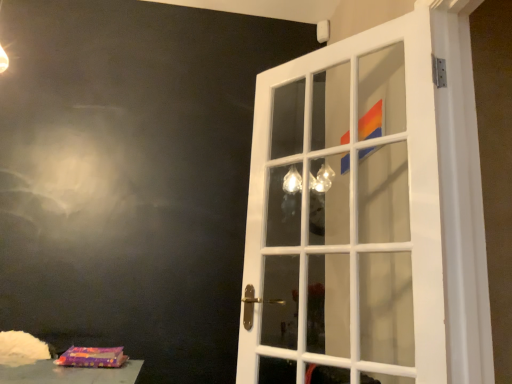
Question: Considering the relative sizes of white glass door at center and purple fabric bag at lower left in the image provided, is white glass door at center shorter than purple fabric bag at lower left?

Choices:
 (A) yes
 (B) no

Answer: (B)

Question: Can you confirm if white glass door at center is taller than purple fabric bag at lower left?

Choices:
 (A) yes
 (B) no

Answer: (A)

Question: Would you say white glass door at center is a long distance from purple fabric bag at lower left?

Choices:
 (A) no
 (B) yes

Answer: (B)

Question: Is white glass door at center located outside purple fabric bag at lower left?

Choices:
 (A) no
 (B) yes

Answer: (B)

Question: Is white glass door at center smaller than purple fabric bag at lower left?

Choices:
 (A) yes
 (B) no

Answer: (B)

Question: Considering the relative positions of white glass door at center and purple fabric bag at lower left in the image provided, is white glass door at center behind purple fabric bag at lower left?

Choices:
 (A) yes
 (B) no

Answer: (B)

Question: Is purple fabric bag at lower left thinner than white glass door at center?

Choices:
 (A) yes
 (B) no

Answer: (A)

Question: From the image's perspective, does purple fabric bag at lower left appear higher than white glass door at center?

Choices:
 (A) yes
 (B) no

Answer: (B)

Question: Can you confirm if purple fabric bag at lower left is taller than white glass door at center?

Choices:
 (A) no
 (B) yes

Answer: (A)

Question: Is purple fabric bag at lower left oriented towards white glass door at center?

Choices:
 (A) yes
 (B) no

Answer: (B)

Question: From a real-world perspective, is purple fabric bag at lower left physically below white glass door at center?

Choices:
 (A) no
 (B) yes

Answer: (B)

Question: From the image's perspective, does purple fabric bag at lower left appear lower than white glass door at center?

Choices:
 (A) no
 (B) yes

Answer: (B)

Question: Considering the positions of purple fabric bag at lower left and white glass door at center in the image, is purple fabric bag at lower left bigger or smaller than white glass door at center?

Choices:
 (A) small
 (B) big

Answer: (A)